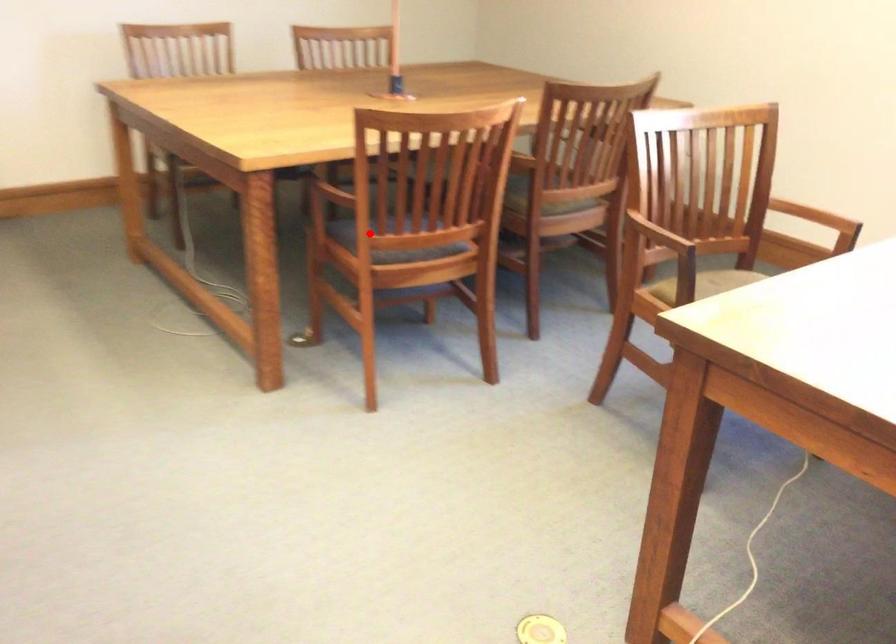
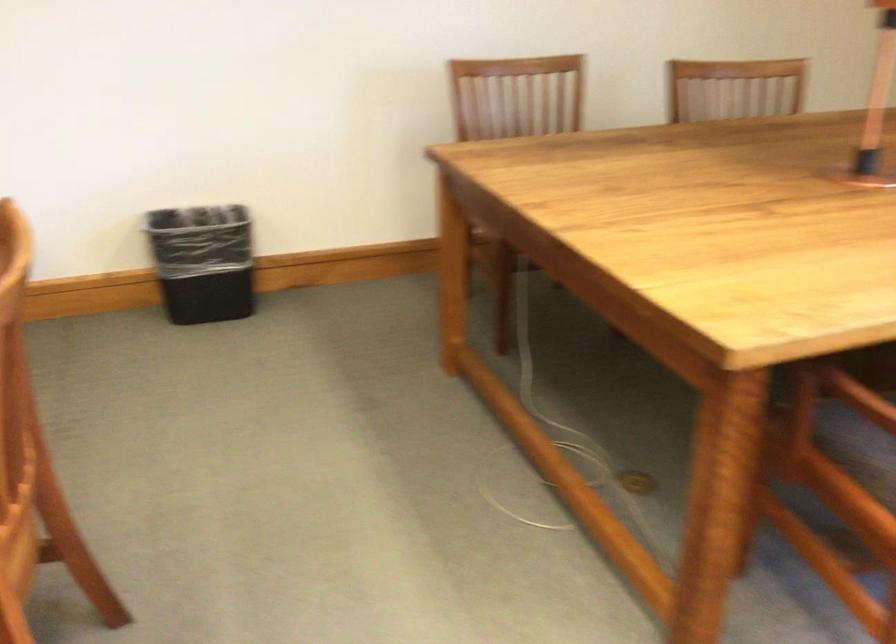
In the second image, find the point that corresponds to the highlighted location in the first image.

(885, 442)